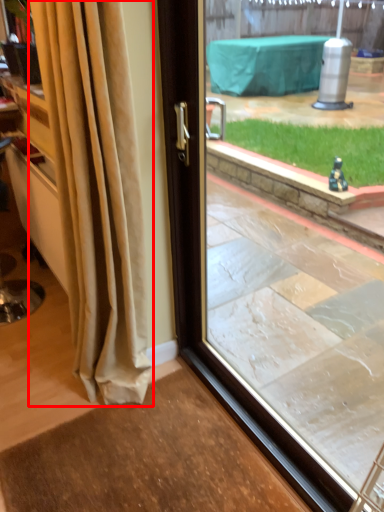
Question: In this image, where is curtain (annotated by the red box) located relative to window?

Choices:
 (A) right
 (B) left

Answer: (B)